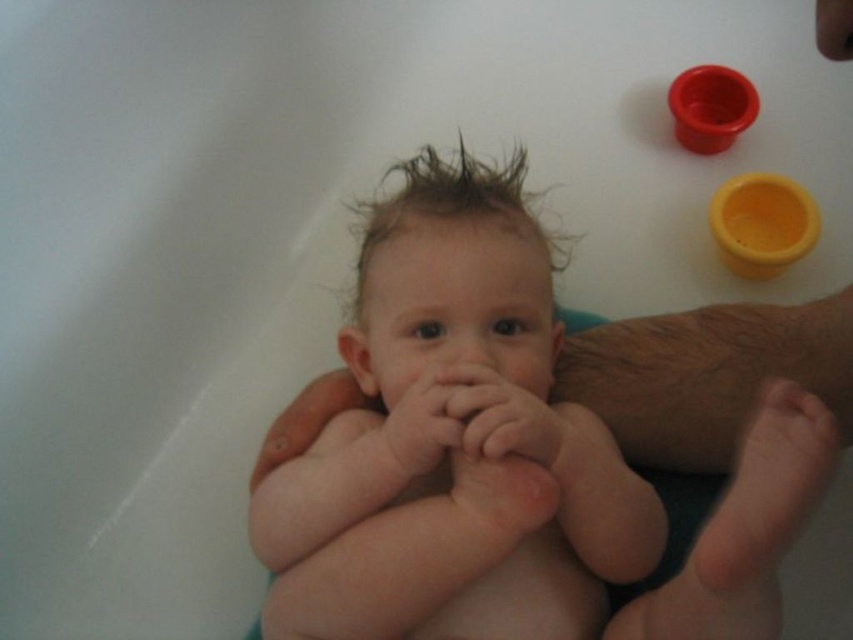
Question: Is pink soft skin at center to the right of matte plastic cup at upper right from the viewer's perspective?

Choices:
 (A) yes
 (B) no

Answer: (B)

Question: Which of the following is the farthest from the observer?

Choices:
 (A) matte plastic cup at upper right
 (B) pink soft skin at center
 (C) yellow matte cup at upper right

Answer: (A)

Question: Which of the following is the farthest from the observer?

Choices:
 (A) pink soft skin at center
 (B) matte plastic cup at upper right

Answer: (B)

Question: Which object is the closest to the matte plastic cup at upper right?

Choices:
 (A) pink soft skin at center
 (B) yellow matte cup at upper right

Answer: (B)

Question: Considering the relative positions of yellow matte cup at upper right and matte plastic cup at upper right in the image provided, where is yellow matte cup at upper right located with respect to matte plastic cup at upper right?

Choices:
 (A) left
 (B) right

Answer: (B)

Question: Is pink soft skin at center bigger than yellow matte cup at upper right?

Choices:
 (A) no
 (B) yes

Answer: (A)